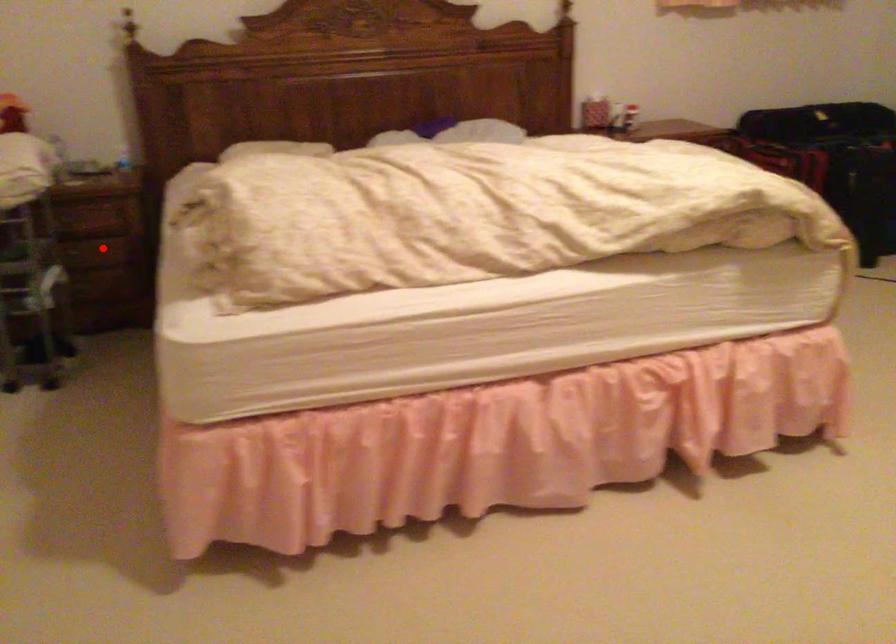
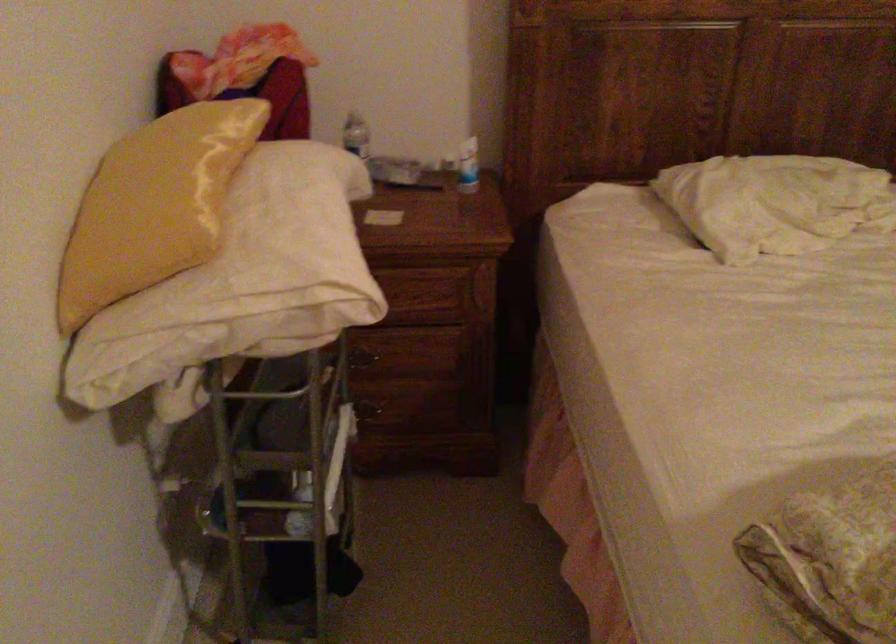
Locate, in the second image, the point that corresponds to the highlighted location in the first image.

(412, 365)